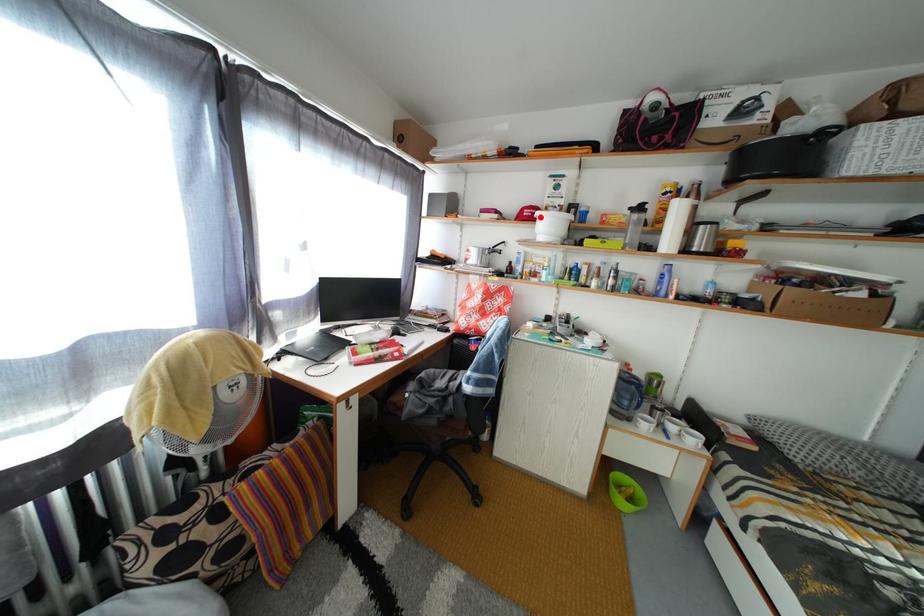
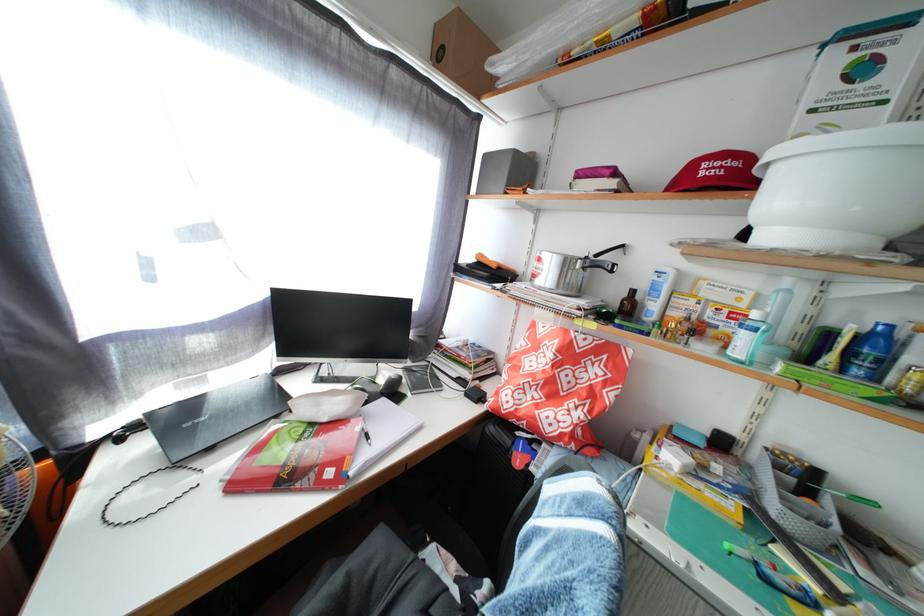
Locate, in the second image, the point that corresponds to the highlighted location in the first image.

(736, 169)